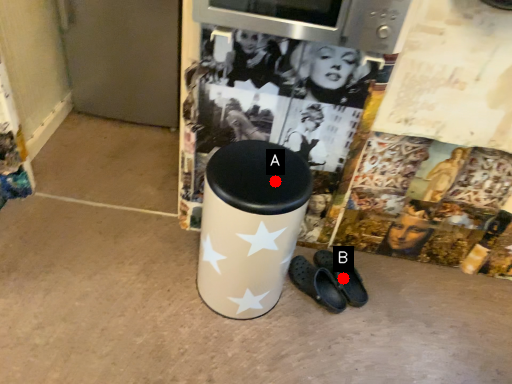
Question: Two points are circled on the image, labeled by A and B beside each circle. Among these points, which one is nearest to the camera?

Choices:
 (A) A is closer
 (B) B is closer

Answer: (A)